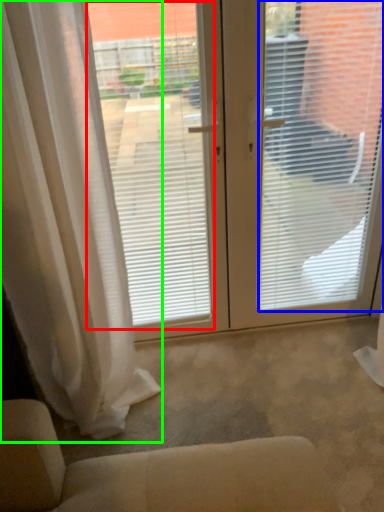
Question: Which object is the closest to the window screen (highlighted by a red box)? Choose among these: window blind (highlighted by a blue box) or curtain (highlighted by a green box).

Choices:
 (A) window blind
 (B) curtain

Answer: (B)